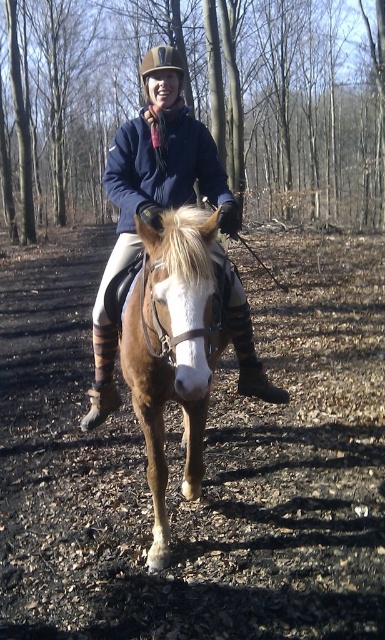
Looking at this image, you are a photographer trying to capture the rider and horse in the image. You want to ensure both points, point (192, 253) and point (147, 113), are in focus. Which point should you focus on first to ensure the other is also in focus?

Point (192, 253) is closer to the viewer than point (147, 113). To ensure both are in focus, focus on the closer point (192, 253) first.

Based on the scene description, where is the brown glossy horse at center located in terms of coordinates?

The brown glossy horse at center is located at coordinates approximately at point (172, 348).

You are a photographer standing at a safe distance from the brown glossy horse at center. You want to capture a closeup shot of the horse without getting too close. Your camera has a zoom range of 200mm. What is the minimum focal length you need to achieve this?

To capture a closeup shot of the brown glossy horse at center from a distance of 5.50 feet, you would need a minimum focal length of 200mm. Since the horse is only 5.50 feet away, a 200mm lens should suffice to get a detailed closeup without needing to approach closer.